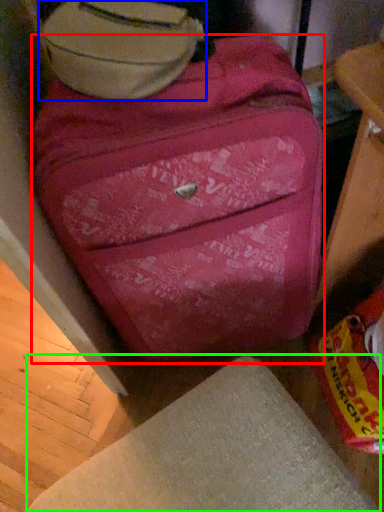
Question: Estimate the real-world distances between objects in this image. Which object is closer to suitcase (highlighted by a red box), luggage (highlighted by a blue box) or furniture (highlighted by a green box)?

Choices:
 (A) luggage
 (B) furniture

Answer: (A)